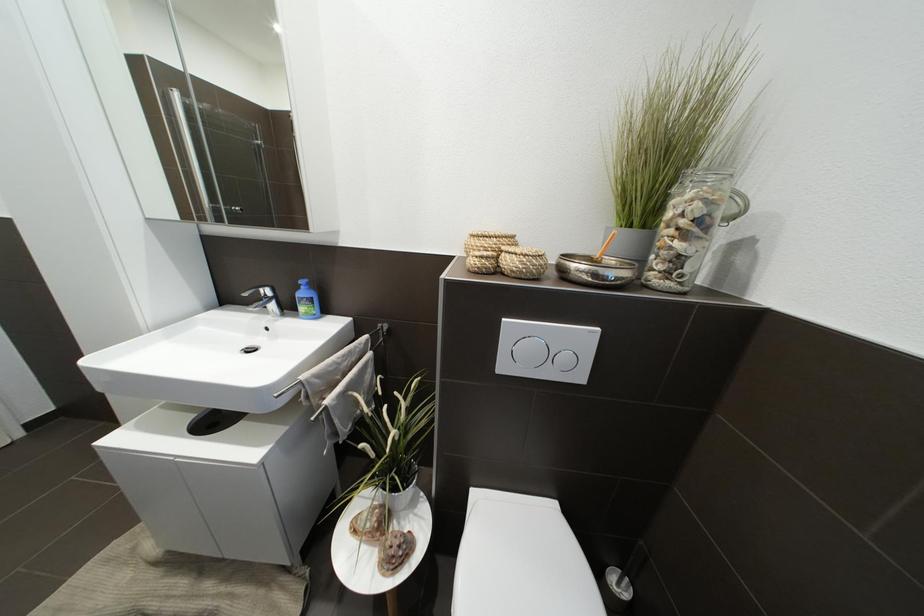
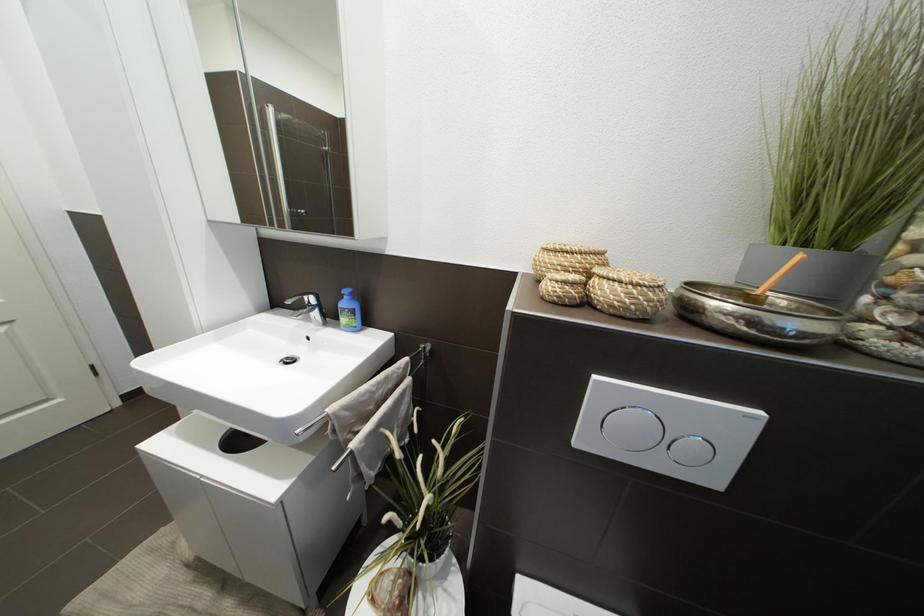
Question: The first image is from the beginning of the video and the second image is from the end. How did the camera likely rotate when shooting the video?

Choices:
 (A) Left
 (B) Right
 (C) Up
 (D) Down

Answer: (A)